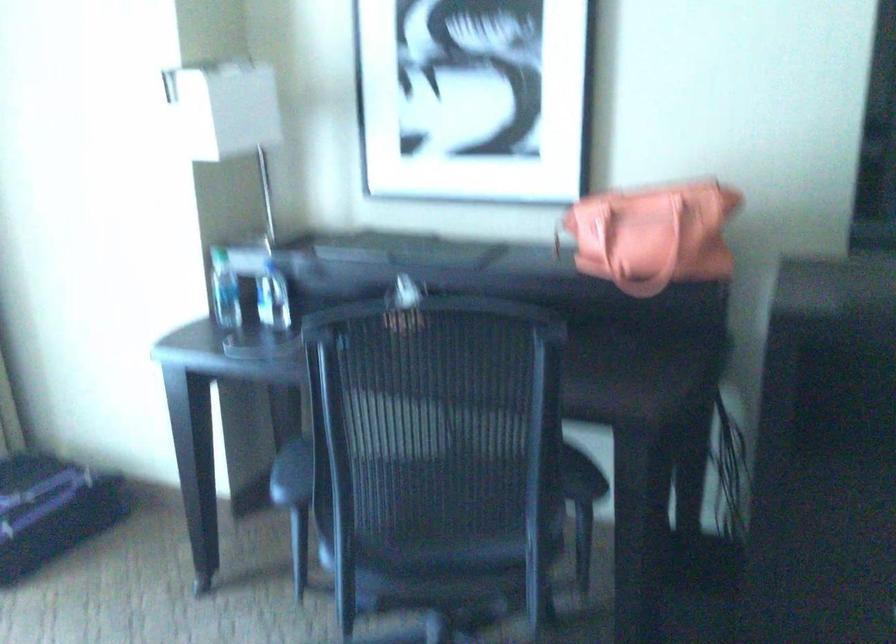
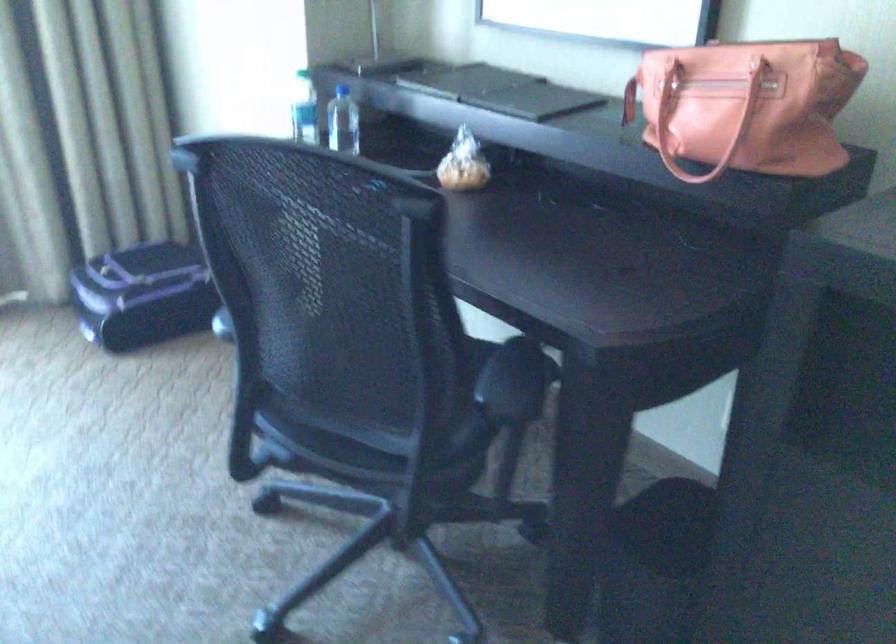
Question: The camera is either moving clockwise (left) or counter-clockwise (right) around the object. The first image is from the beginning of the video and the second image is from the end. Is the camera moving left or right when shooting the video?

Choices:
 (A) Left
 (B) Right

Answer: (B)